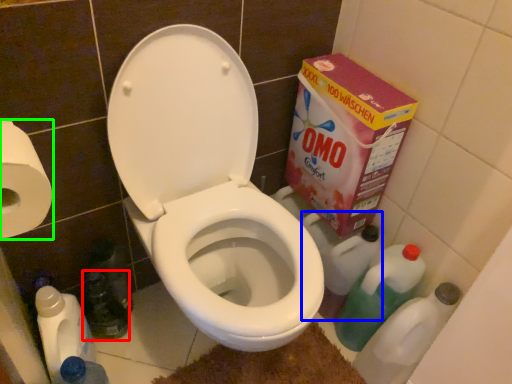
Question: Estimate the real-world distances between objects in this image. Which object is closer to bottle (highlighted by a red box), cleaning product (highlighted by a blue box) or toilet paper (highlighted by a green box)?

Choices:
 (A) cleaning product
 (B) toilet paper

Answer: (B)